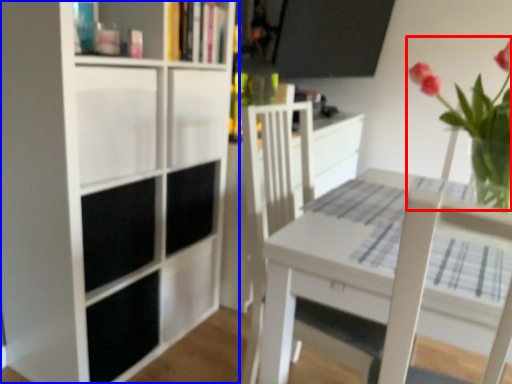
Question: Among these objects, which one is farthest to the camera, floral arrangement (highlighted by a red box) or bookcase (highlighted by a blue box)?

Choices:
 (A) floral arrangement
 (B) bookcase

Answer: (B)